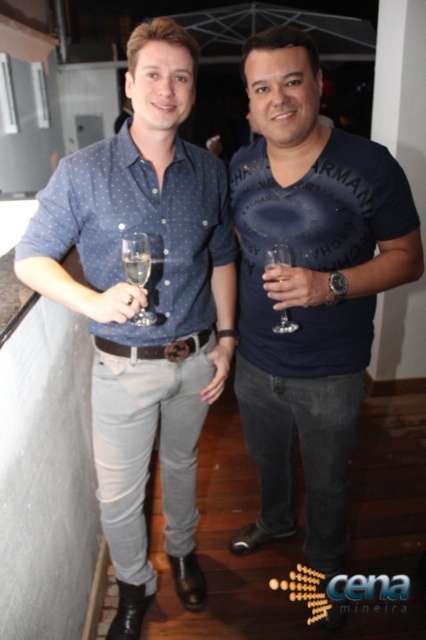
You are at a social event and see the clear glass at center. Where is the clear glass located in terms of coordinates?

The clear glass at center is located at coordinates point (137, 259).